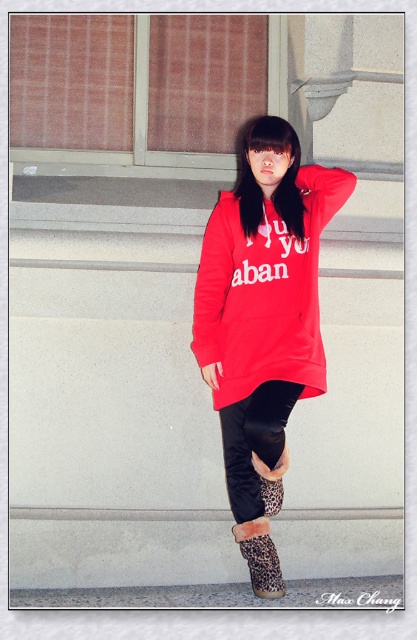
Question: Which of the following is the farthest from the observer?

Choices:
 (A) leopard print fur boots at lower center
 (B) matte red sweatshirt at center

Answer: (A)

Question: Does matte red sweatshirt at center have a greater width compared to leopard print fur boots at lower center?

Choices:
 (A) no
 (B) yes

Answer: (B)

Question: Among these objects, which one is farthest from the camera?

Choices:
 (A) leopard print fur boots at lower center
 (B) matte red sweatshirt at center

Answer: (A)

Question: Is matte red sweatshirt at center bigger than leopard print fur boots at lower center?

Choices:
 (A) no
 (B) yes

Answer: (B)

Question: Can you confirm if matte red sweatshirt at center is positioned above leopard print fur boots at lower center?

Choices:
 (A) no
 (B) yes

Answer: (B)